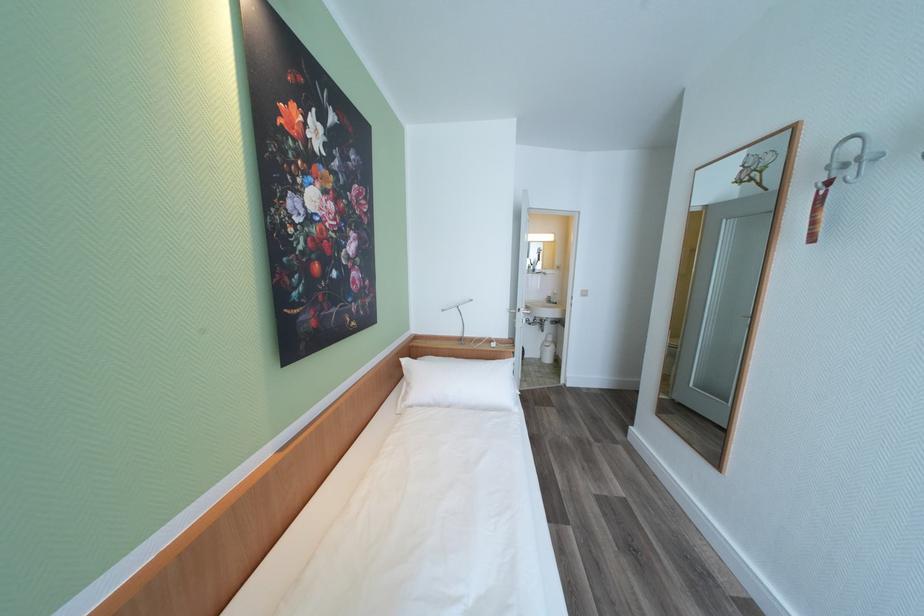
In order to click on silver door handle in this screenshot , I will do `click(518, 309)`.